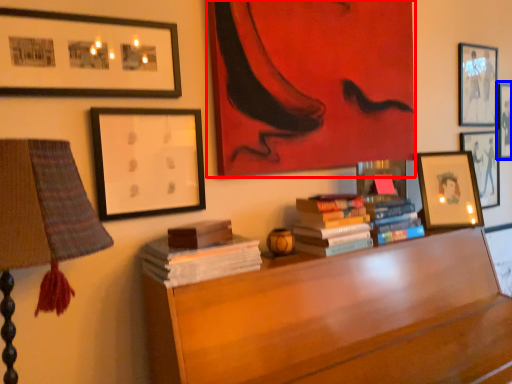
Question: Which point is closer to the camera, picture frame (highlighted by a red box) or picture frame (highlighted by a blue box)?

Choices:
 (A) picture frame
 (B) picture frame

Answer: (A)